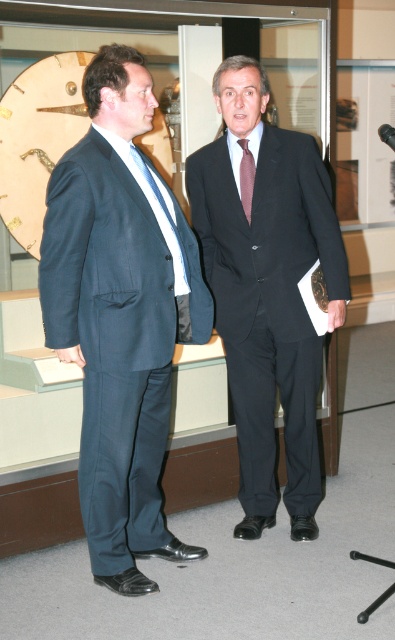
Question: Which is farther from the black matte suit at center?

Choices:
 (A) matte blue suit at left
 (B) purple silk tie at center

Answer: (A)

Question: Does matte blue suit at left appear on the right side of purple silk tie at center?

Choices:
 (A) yes
 (B) no

Answer: (B)

Question: Is matte blue suit at left below black matte suit at center?

Choices:
 (A) yes
 (B) no

Answer: (A)

Question: Does matte blue suit at left appear under purple silk tie at center?

Choices:
 (A) yes
 (B) no

Answer: (A)

Question: Among these objects, which one is nearest to the camera?

Choices:
 (A) matte blue suit at left
 (B) black matte suit at center

Answer: (A)

Question: Which object is the closest to the black matte suit at center?

Choices:
 (A) purple silk tie at center
 (B) matte blue suit at left

Answer: (A)